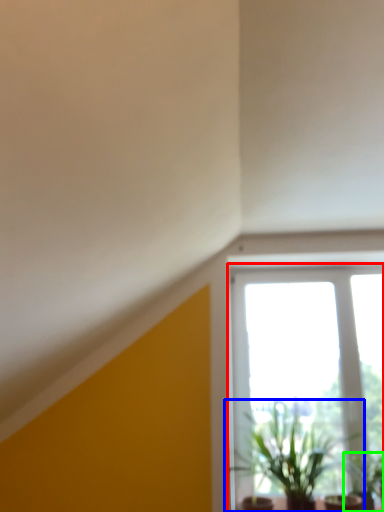
Question: Considering the real-world distances, which object is farthest from window (highlighted by a red box)? houseplant (highlighted by a blue box) or houseplant (highlighted by a green box)?

Choices:
 (A) houseplant
 (B) houseplant

Answer: (B)